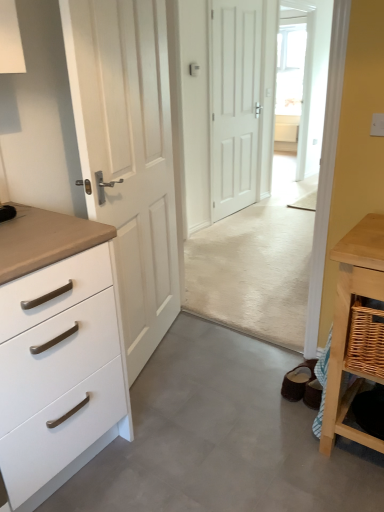
Where is `vacant space in between white wood door at left, positioned as the 1th door in left-to-right order, and woven wood table at right`? Image resolution: width=384 pixels, height=512 pixels. vacant space in between white wood door at left, positioned as the 1th door in left-to-right order, and woven wood table at right is located at coordinates (222, 374).